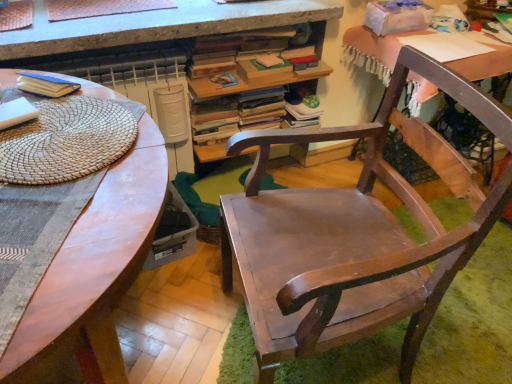
Where is `free space above woven beige placemat at left (from a real-world perspective)`? This screenshot has width=512, height=384. free space above woven beige placemat at left (from a real-world perspective) is located at coordinates (65, 126).